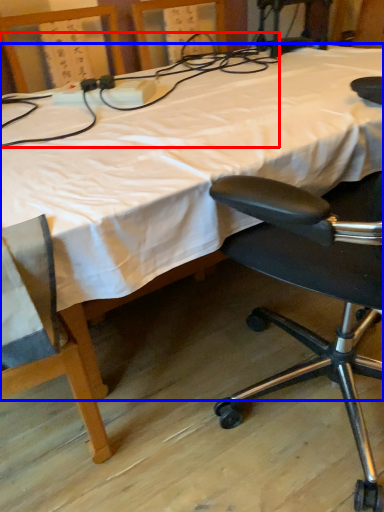
Question: Which object appears closest to the camera in this image, twin (highlighted by a red box) or bed (highlighted by a blue box)?

Choices:
 (A) twin
 (B) bed

Answer: (B)